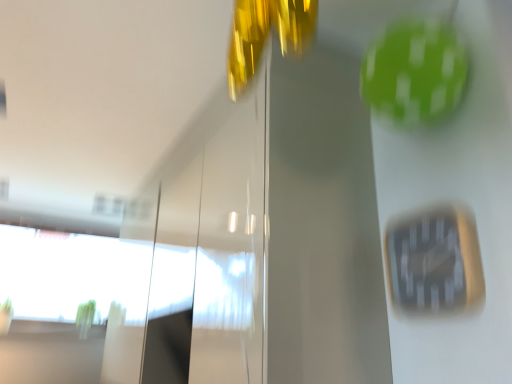
You are a GUI agent. You are given a task and a screenshot of the screen. Output one action in this format:
    pyautogui.click(x=<x>, y=<y>)
    Task: Click on the transparent glass window at lower left
    This screenshot has width=512, height=384.
    Given the screenshot: What is the action you would take?
    pyautogui.click(x=71, y=274)

This screenshot has width=512, height=384. Describe the element at coordinates (71, 274) in the screenshot. I see `transparent glass window at lower left` at that location.

What do you see at coordinates (434, 261) in the screenshot? The image size is (512, 384). I see `black plastic clock at center-right` at bounding box center [434, 261].

The height and width of the screenshot is (384, 512). In order to click on black plastic clock at center-right in this screenshot , I will do `click(434, 261)`.

Measure the distance between point (393, 278) and camera.

Point (393, 278) is 1.10 meters away from camera.

Identify the location of transparent glass window at lower left. (71, 274).

Considering the positions of objects black plastic clock at center-right and transparent glass window at lower left in the image provided, who is more to the left, black plastic clock at center-right or transparent glass window at lower left?

From the viewer's perspective, transparent glass window at lower left appears more on the left side.

Is black plastic clock at center-right positioned behind transparent glass window at lower left?

No, black plastic clock at center-right is closer to the camera.

Does point (461, 287) lie behind point (72, 318)?

No, (461, 287) is closer to viewer.

From the image's perspective, between black plastic clock at center-right and transparent glass window at lower left, who is located below?

From the image's view, transparent glass window at lower left is below.

From a real-world perspective, is black plastic clock at center-right above or below transparent glass window at lower left?

From a real-world perspective, black plastic clock at center-right is physically below transparent glass window at lower left.

Is black plastic clock at center-right wider than transparent glass window at lower left?

Incorrect, the width of black plastic clock at center-right does not surpass that of transparent glass window at lower left.

Considering the relative sizes of black plastic clock at center-right and transparent glass window at lower left in the image provided, is black plastic clock at center-right shorter than transparent glass window at lower left?

Yes, black plastic clock at center-right is shorter than transparent glass window at lower left.

Does black plastic clock at center-right have a larger size compared to transparent glass window at lower left?

Incorrect, black plastic clock at center-right is not larger than transparent glass window at lower left.

Is transparent glass window at lower left inside black plastic clock at center-right?

No, black plastic clock at center-right does not contain transparent glass window at lower left.

Is black plastic clock at center-right touching transparent glass window at lower left?

They are not placed beside each other.

Is black plastic clock at center-right looking in the opposite direction of transparent glass window at lower left?

That's not correct — black plastic clock at center-right is not looking away from transparent glass window at lower left.

You are a GUI agent. You are given a task and a screenshot of the screen. Output one action in this format:
    pyautogui.click(x=<x>, y=<y>)
    Task: Click on the clock located in front of the transparent glass window at lower left
    The image size is (512, 384).
    Given the screenshot: What is the action you would take?
    pyautogui.click(x=434, y=261)

In the scene shown: Which is more to the right, transparent glass window at lower left or black plastic clock at center-right?

black plastic clock at center-right.

Which object is further away from the camera, transparent glass window at lower left or black plastic clock at center-right?

transparent glass window at lower left.

Which is further, (23, 285) or (395, 230)?

The point (23, 285) is farther from the camera.

From the image's perspective, which one is positioned higher, transparent glass window at lower left or black plastic clock at center-right?

black plastic clock at center-right is shown above in the image.

Based on the photo, from a real-world perspective, which object rests below the other?

In real-world perspective, black plastic clock at center-right is lower.

Is transparent glass window at lower left wider or thinner than black plastic clock at center-right?

Considering their sizes, transparent glass window at lower left looks broader than black plastic clock at center-right.

Who is shorter, transparent glass window at lower left or black plastic clock at center-right?

black plastic clock at center-right is shorter.

In terms of size, does transparent glass window at lower left appear bigger or smaller than black plastic clock at center-right?

In the image, transparent glass window at lower left appears to be larger than black plastic clock at center-right.

Is transparent glass window at lower left spatially inside black plastic clock at center-right, or outside of it?

The correct answer is: outside.

Is transparent glass window at lower left far away from black plastic clock at center-right?

Yes, transparent glass window at lower left is far from black plastic clock at center-right.

Is transparent glass window at lower left aimed at black plastic clock at center-right?

Yes, transparent glass window at lower left is oriented towards black plastic clock at center-right.

Looking at this image, how distant is transparent glass window at lower left from black plastic clock at center-right?

transparent glass window at lower left is 2.65 meters from black plastic clock at center-right.

Locate an element on the screen. This screenshot has width=512, height=384. window behind the black plastic clock at center-right is located at coordinates pos(71,274).

This screenshot has height=384, width=512. What are the coordinates of `window behind the black plastic clock at center-right` in the screenshot? It's located at (71, 274).

At what (x,y) coordinates should I click in order to perform the action: click on window above the black plastic clock at center-right (from a real-world perspective). Please return your answer as a coordinate pair (x, y). The width and height of the screenshot is (512, 384). Looking at the image, I should click on (71, 274).